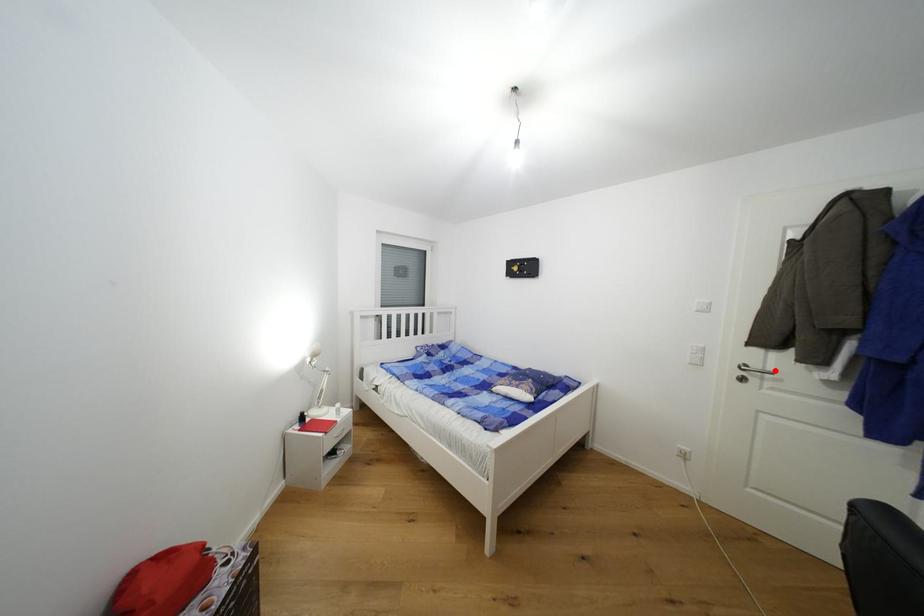
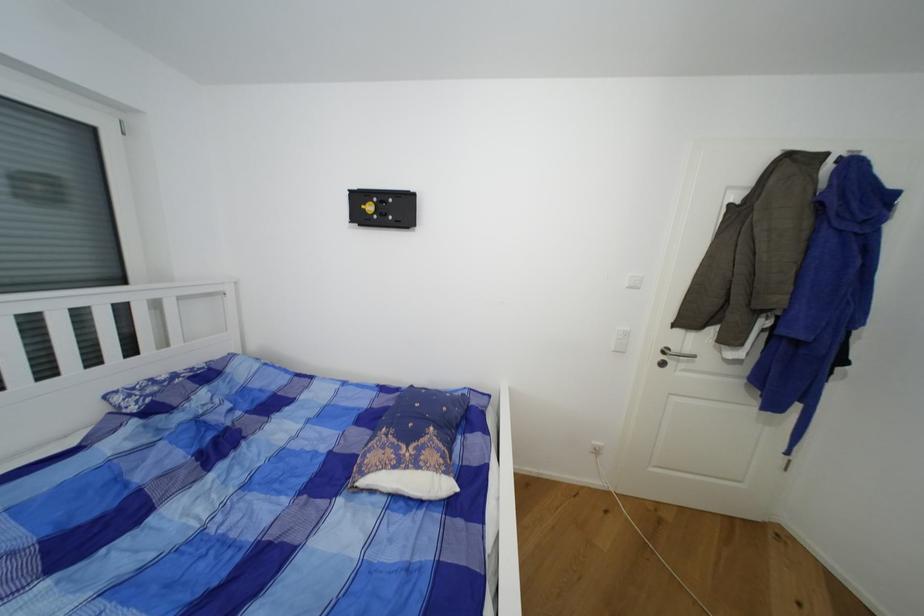
In the second image, find the point that corresponds to the highlighted location in the first image.

(691, 352)